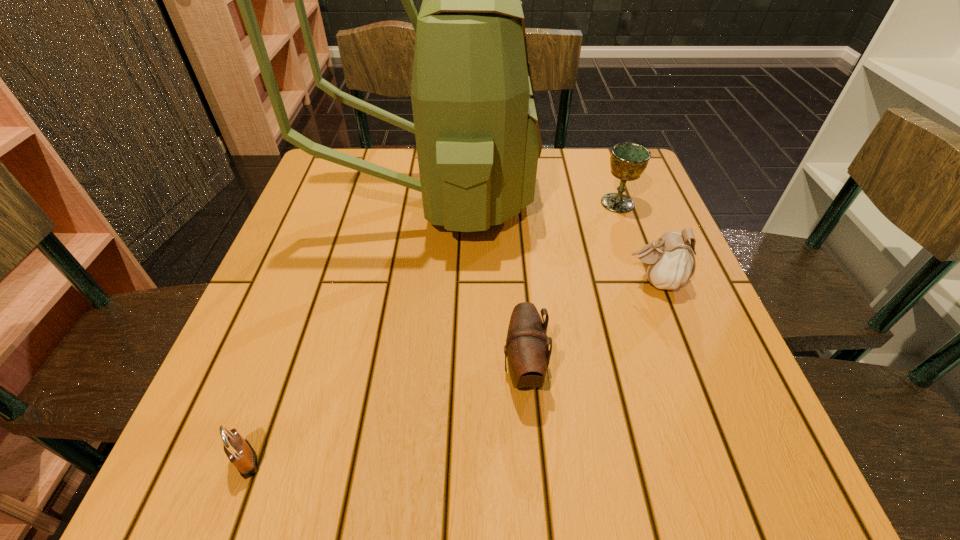
This screenshot has width=960, height=540. I want to click on free space located 0.210m on the front-facing side of the farther pouch, so click(520, 281).

Image resolution: width=960 pixels, height=540 pixels. Find the location of `vacant region located on the front-facing side of the farther pouch`. vacant region located on the front-facing side of the farther pouch is located at coordinates (445, 281).

Identify the location of vacant space located 0.080m on the front-facing side of the farther pouch. The height and width of the screenshot is (540, 960). (586, 281).

This screenshot has width=960, height=540. What are the coordinates of `vacant space located 0.060m with the flap open on the left pouch` in the screenshot? It's located at (467, 369).

What are the coordinates of `vacant space located 0.120m with the flap open on the left pouch` in the screenshot? It's located at (431, 369).

At what (x,y) coordinates should I click in order to perform the action: click on free spot located with the flap open on the left pouch. Please return your answer as a coordinate pair (x, y). The image size is (960, 540). Looking at the image, I should click on (431, 369).

Find the location of a particular element. free region located on the right of the nearest object is located at coordinates (380, 460).

What are the coordinates of `backpack positioned at the far edge` in the screenshot? It's located at (476, 125).

The width and height of the screenshot is (960, 540). Find the location of `chalice located in the far edge section of the desktop`. chalice located in the far edge section of the desktop is located at coordinates (x=628, y=161).

The width and height of the screenshot is (960, 540). I want to click on object situated at the near edge, so click(241, 454).